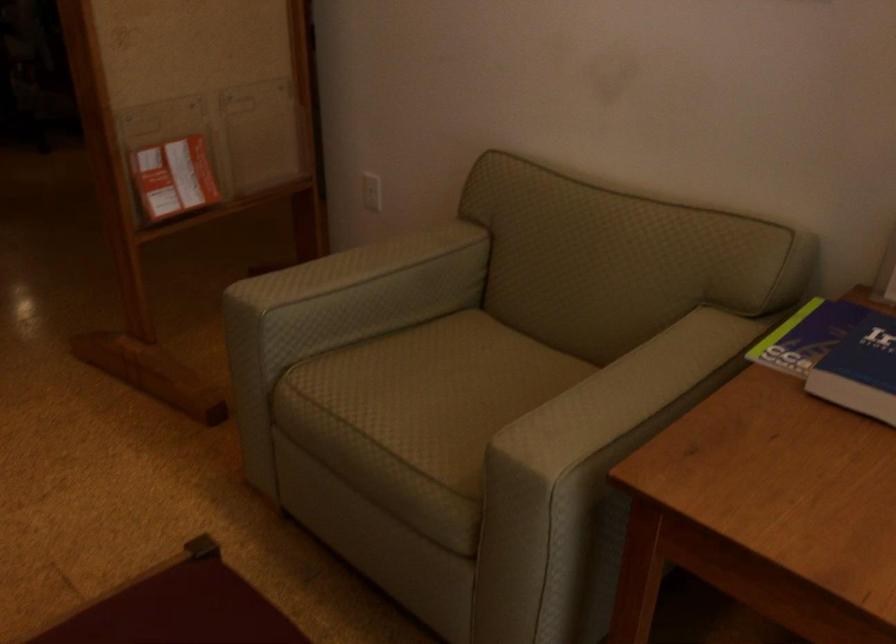
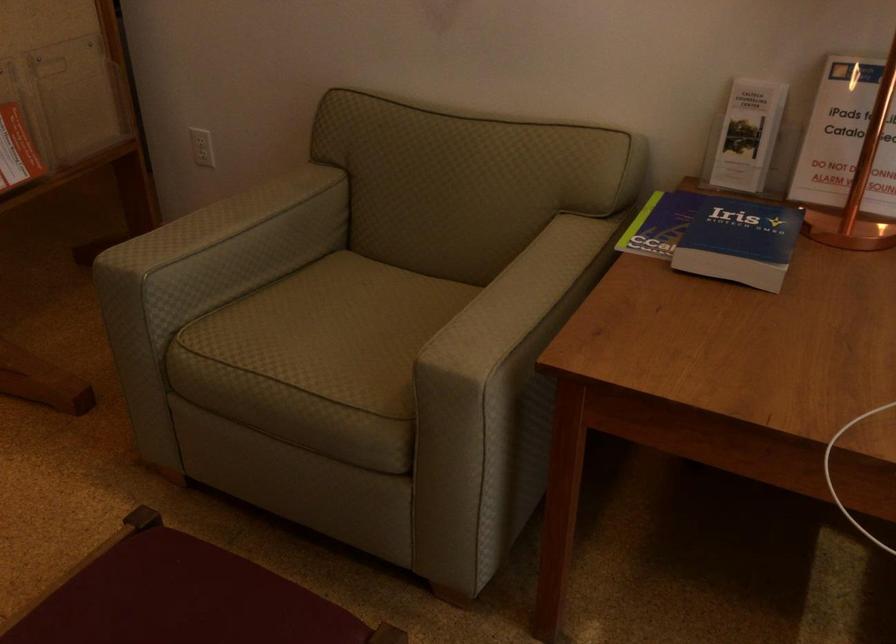
Locate, in the second image, the point that corresponds to point 616,399 in the first image.

(515, 299)